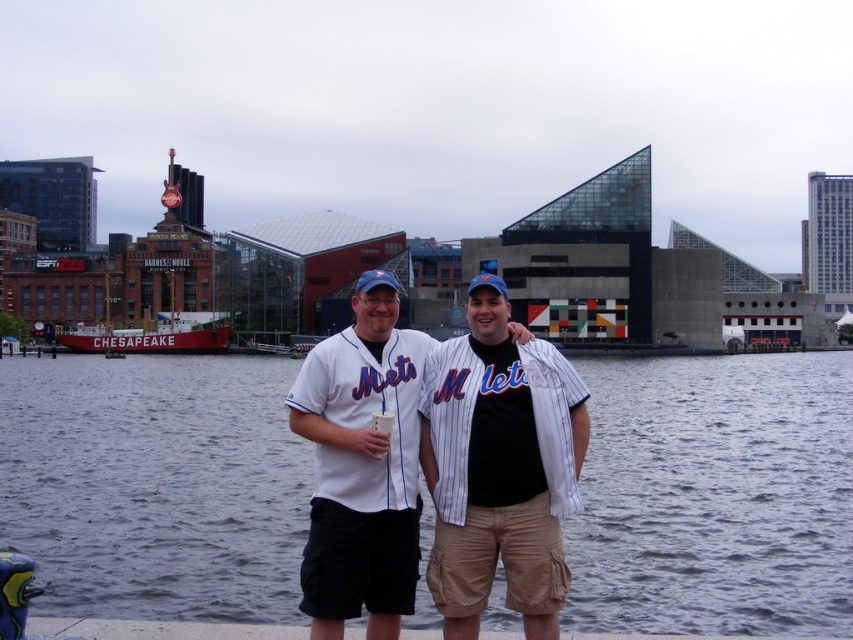
Can you confirm if gray water at center is thinner than white pinstriped jersey at center?

No.

Who is lower down, gray water at center or white pinstriped jersey at center?

white pinstriped jersey at center is below.

Which is in front, point (83, 532) or point (309, 561)?

Positioned in front is point (309, 561).

This screenshot has height=640, width=853. What are the coordinates of `gray water at center` in the screenshot? It's located at (715, 497).

Can you confirm if white jersey at center is taller than white wooden boat at left?

Indeed, white jersey at center has a greater height compared to white wooden boat at left.

Describe the element at coordinates (363, 476) in the screenshot. I see `white jersey at center` at that location.

Which is in front, point (355, 483) or point (228, 333)?

Point (355, 483) is in front.

You are a GUI agent. You are given a task and a screenshot of the screen. Output one action in this format:
    pyautogui.click(x=<x>, y=<y>)
    Task: Click on the white jersey at center
    The width and height of the screenshot is (853, 640).
    Given the screenshot: What is the action you would take?
    pyautogui.click(x=363, y=476)

Can you confirm if gray water at center is shorter than white wooden boat at left?

Correct, gray water at center is not as tall as white wooden boat at left.

Who is more forward, (x=791, y=381) or (x=111, y=337)?

Positioned in front is point (x=791, y=381).

Between point (717, 412) and point (125, 342), which one is positioned in front?

Point (717, 412) is more forward.

Where is `gray water at center`? gray water at center is located at coordinates 715,497.